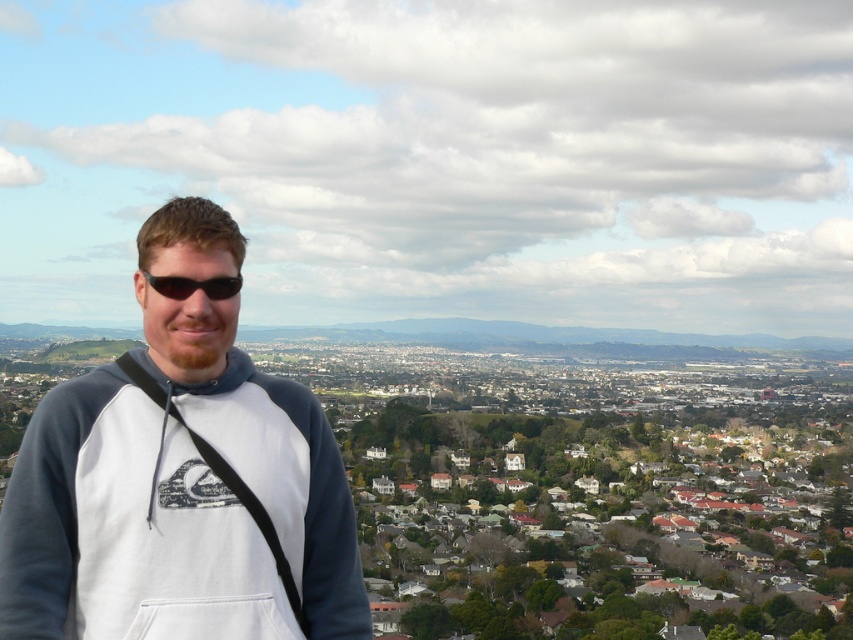
Is white fleece sweatshirt at center below black matte sunglasses at center?

Yes.

Is point (4, 624) closer to camera compared to point (228, 298)?

Yes, point (4, 624) is in front of point (228, 298).

From the picture: Who is more forward, (x=238, y=476) or (x=187, y=282)?

Point (x=238, y=476)

This screenshot has width=853, height=640. I want to click on white fleece sweatshirt at center, so click(178, 480).